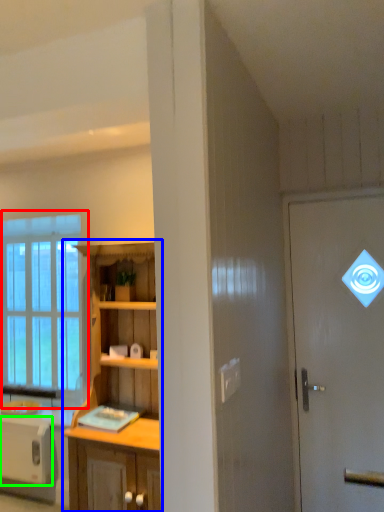
Question: Which object is positioned farthest from window (highlighted by a red box)? Select from cabinetry (highlighted by a blue box) and appliance (highlighted by a green box).

Choices:
 (A) cabinetry
 (B) appliance

Answer: (A)